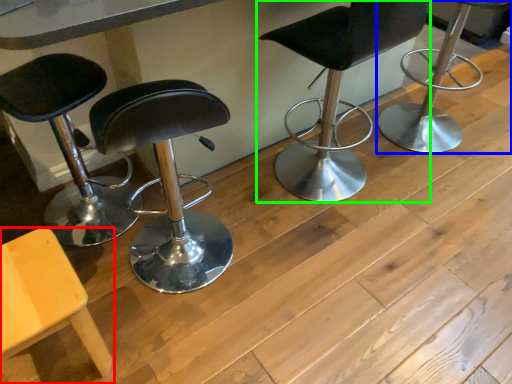
Question: Which object is the farthest from chair (highlighted by a red box)? Choose among these: chair (highlighted by a blue box) or chair (highlighted by a green box).

Choices:
 (A) chair
 (B) chair

Answer: (A)